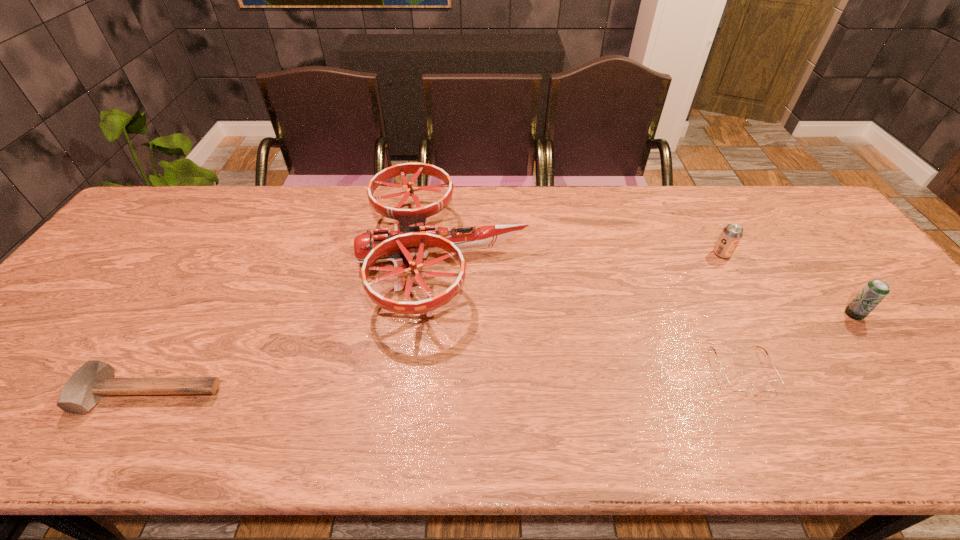
Image resolution: width=960 pixels, height=540 pixels. I want to click on free space located 0.190m on the left of the right beer can, so click(771, 314).

You are a GUI agent. You are given a task and a screenshot of the screen. Output one action in this format:
    pyautogui.click(x=<x>, y=<y>)
    Task: Click on the vacant area situated 0.180m on the right of the farther beer can
    This screenshot has width=960, height=540.
    Given the screenshot: What is the action you would take?
    pyautogui.click(x=793, y=254)

You are a GUI agent. You are given a task and a screenshot of the screen. Output one action in this format:
    pyautogui.click(x=<x>, y=<y>)
    Task: Click on the free space located on the right of the leftmost object
    
    Given the screenshot: What is the action you would take?
    pyautogui.click(x=275, y=393)

Identify the location of vacant space located on the front-facing side of the third object from left to right. The height and width of the screenshot is (540, 960). (780, 446).

Where is `object that is at the far edge`? object that is at the far edge is located at coordinates (411, 237).

Locate an element on the screen. The height and width of the screenshot is (540, 960). object located at the near edge is located at coordinates (86, 387).

Where is `object at the right edge`? This screenshot has width=960, height=540. object at the right edge is located at coordinates click(x=875, y=291).

This screenshot has height=540, width=960. I want to click on vacant space at the far edge of the desktop, so click(728, 214).

The image size is (960, 540). In order to click on vacant space at the left edge in this screenshot , I will do `click(169, 232)`.

This screenshot has width=960, height=540. Find the location of `free space at the right edge of the desktop`. free space at the right edge of the desktop is located at coordinates (836, 269).